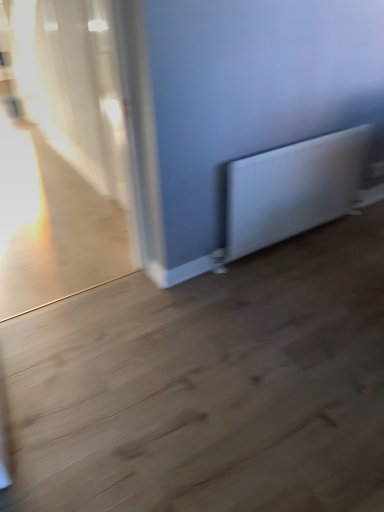
The image size is (384, 512). I want to click on white matte radiator at lower right, so click(293, 189).

Describe the element at coordinates (293, 189) in the screenshot. I see `white matte radiator at lower right` at that location.

In order to face white matte radiator at lower right, should I rotate leftwards or rightwards?

Turn right by 14.418 degrees to look at white matte radiator at lower right.

Identify the location of white matte radiator at lower right. The width and height of the screenshot is (384, 512). (293, 189).